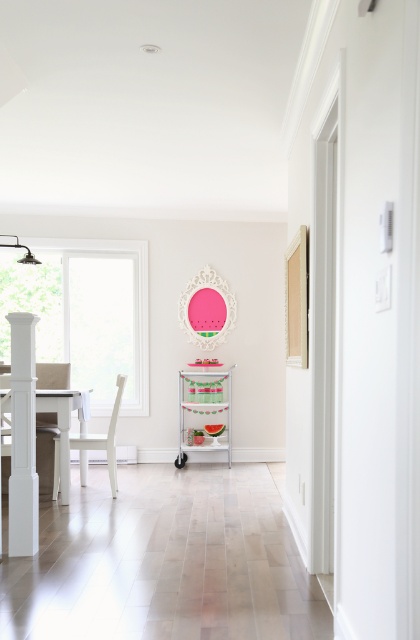
You are standing in the dining area and want to walk towards the window. There are two points marked in the scene, point 1 at coordinates point (81,396) and point 2 at coordinates point (73,433). Which point is closer to the window?

Point (81,396) is in front of point (73,433), so it is closer to the window.

You are planning to place a rectangular dining set in this space. The white glossy table at left is currently placed next to the white matte chair at left. Based on their sizes, which object is narrower?

The white glossy table at left has a lesser width compared to the white matte chair at left, so the table is narrower than the chair.

In the scene shown: You are a delivery person carrying a package that is 10 inches wide. You need to place it between the white glossy table at left and the white matte chair at left. Is there enough space for the package to fit between them?

The distance between the white glossy table at left and the white matte chair at left is 9.82 inches. Since the package is 10 inches wide, it will not fit between them as the space is slightly narrower than the package.